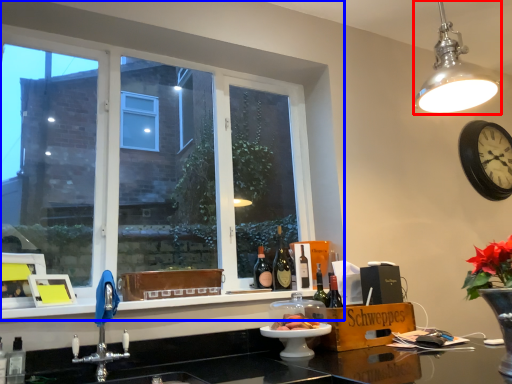
Question: Which point is further to the camera, light fixture (highlighted by a red box) or window (highlighted by a blue box)?

Choices:
 (A) light fixture
 (B) window

Answer: (B)